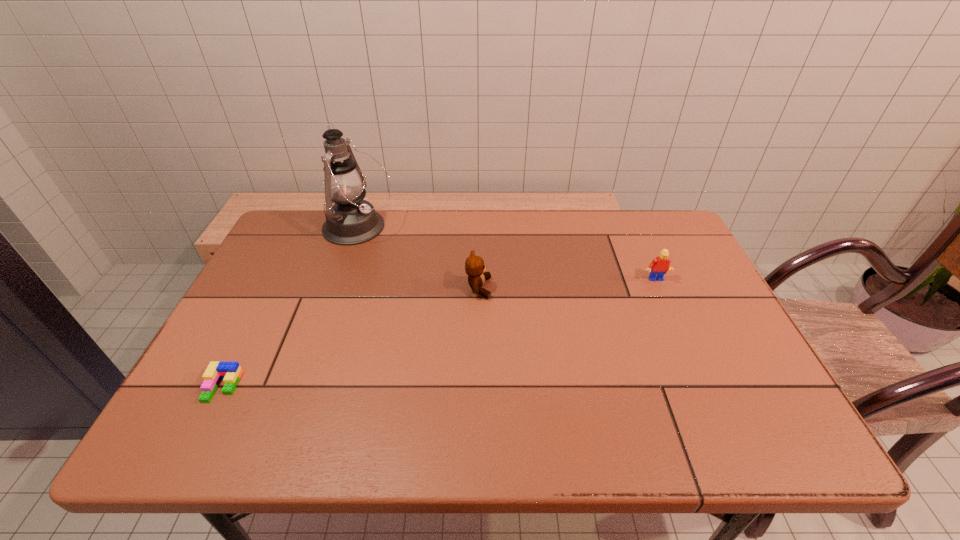
Image resolution: width=960 pixels, height=540 pixels. Find the location of `free space between the taller Lego and the second object from left to right`. free space between the taller Lego and the second object from left to right is located at coordinates (507, 254).

Locate an element on the screen. This screenshot has height=540, width=960. free space between the taller Lego and the third object from left to right is located at coordinates (566, 284).

The image size is (960, 540). I want to click on the second closest object to the second object from right to left, so click(x=659, y=266).

Choose which object is the second nearest neighbor to the teddy bear. Please provide its 2D coordinates. Your answer should be formatted as a tuple, i.e. [(x, y)], where the tuple contains the x and y coordinates of a point satisfying the conditions above.

[(659, 266)]

Locate an element on the screen. This screenshot has height=540, width=960. free space that satisfies the following two spatial constraints: 1. on the front-facing side of the farther Lego; 2. on the front-facing side of the teddy bear is located at coordinates (659, 288).

At what (x,y) coordinates should I click in order to perform the action: click on vacant space that satisfies the following two spatial constraints: 1. on the front-facing side of the rightmost object; 2. on the front-facing side of the third object from left to right. Please return your answer as a coordinate pair (x, y). Looking at the image, I should click on (659, 288).